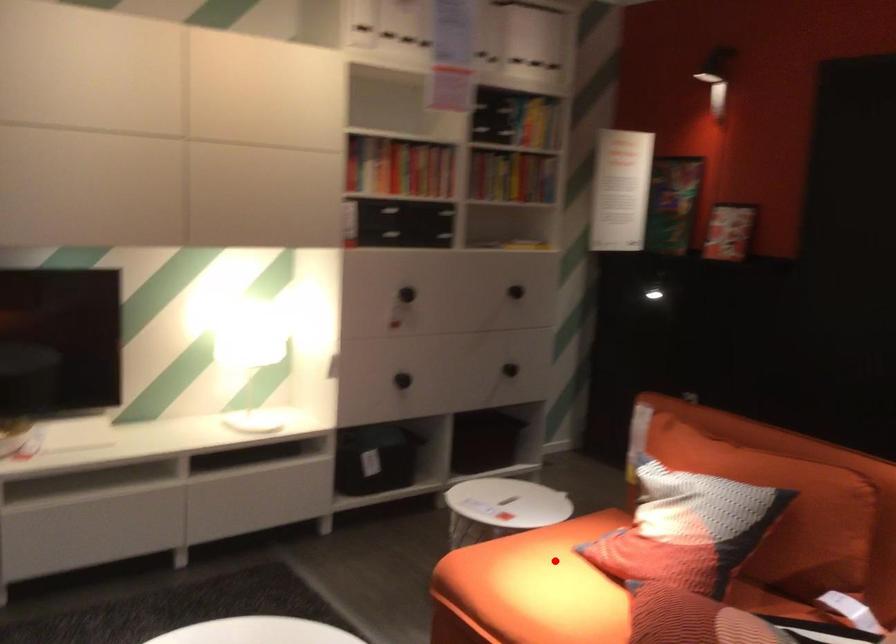
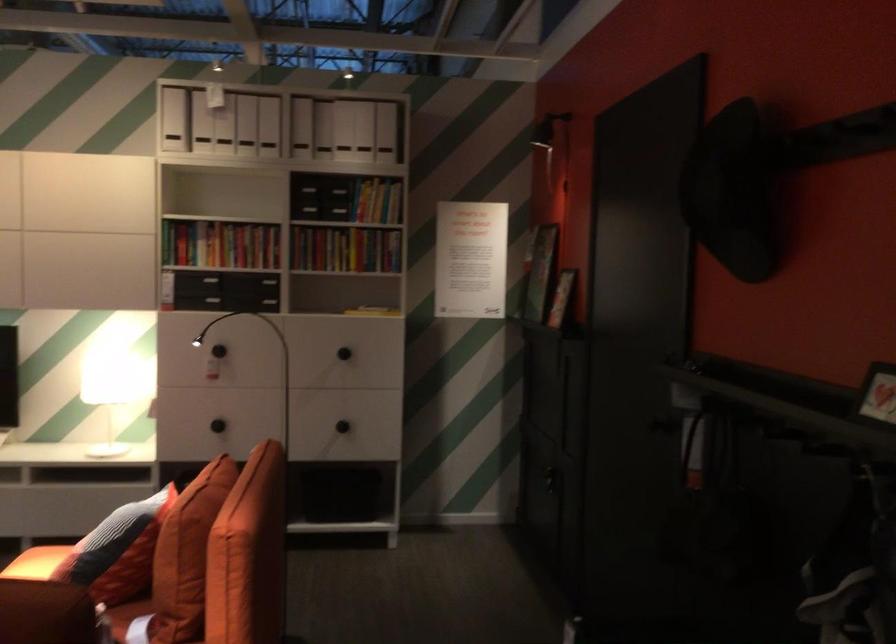
Question: I am providing you with two images of the same scene from different viewpoints. Given a red point in image1, look at the same physical point in image2. Is it:

Choices:
 (A) Closer to the viewpoint
 (B) Farther from the viewpoint

Answer: (B)